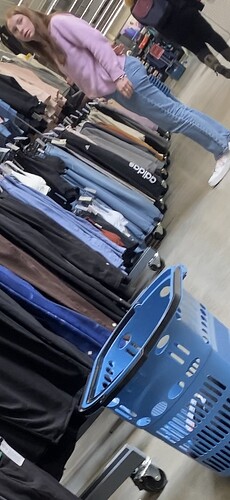
You are a GUI agent. You are given a task and a screenshot of the screen. Output one action in this format:
    pyautogui.click(x=<x>, y=<y>)
    Task: Click on the floor
    
    Given the screenshot: What is the action you would take?
    pyautogui.click(x=125, y=437)